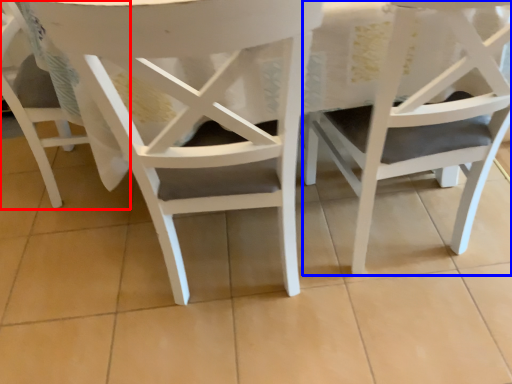
Question: Among these objects, which one is farthest to the camera, chair (highlighted by a red box) or chair (highlighted by a blue box)?

Choices:
 (A) chair
 (B) chair

Answer: (A)